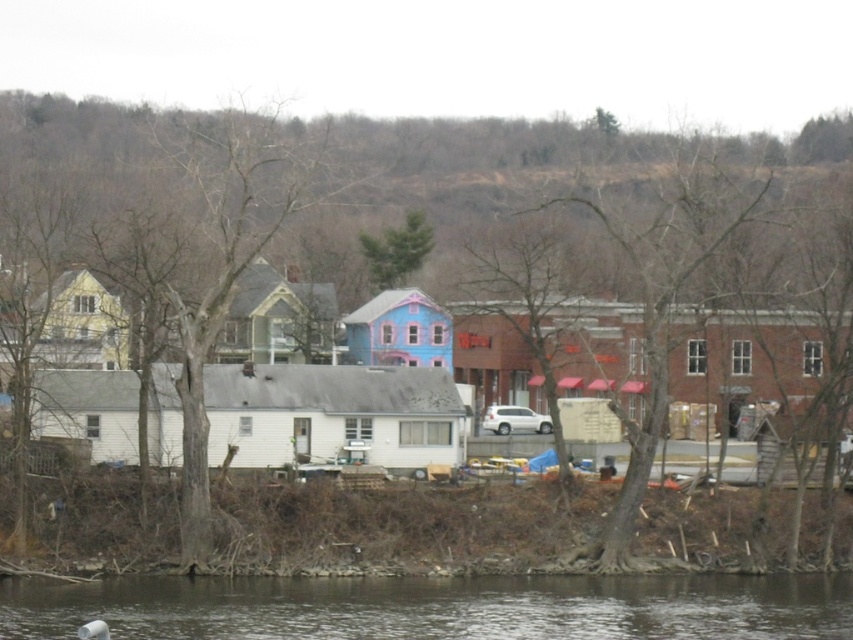
Question: Which of the following is the farthest from the observer?

Choices:
 (A) (637, 506)
 (B) (370, 241)
 (C) (3, 262)
 (D) (192, 580)

Answer: (B)

Question: Can you confirm if brown muddy water at lower center is positioned above green matte tree at upper center?

Choices:
 (A) no
 (B) yes

Answer: (A)

Question: Is bare wood tree at center positioned at the back of brown bark tree at left?

Choices:
 (A) yes
 (B) no

Answer: (B)

Question: Which of these objects is positioned closest to the brown bark tree at left?

Choices:
 (A) bare branches at center
 (B) bare wood tree at center

Answer: (B)

Question: Which point is farther to the camera?

Choices:
 (A) green matte tree at upper center
 (B) brown bark tree at left
 (C) brown muddy water at lower center

Answer: (A)

Question: Can you confirm if brown muddy water at lower center is smaller than green matte tree at upper center?

Choices:
 (A) yes
 (B) no

Answer: (B)